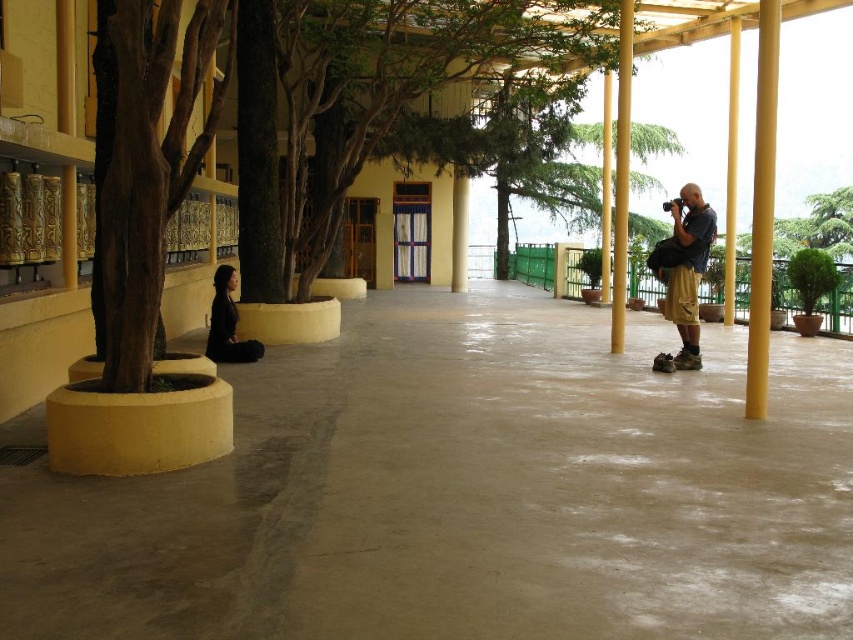
Question: Can you confirm if yellow matte/porous pillar at right is thinner than yellow polished wood pillar at right?

Choices:
 (A) no
 (B) yes

Answer: (B)

Question: Is matte khaki shorts at right to the right of yellow polished wood pillar at right from the viewer's perspective?

Choices:
 (A) yes
 (B) no

Answer: (B)

Question: Among these points, which one is nearest to the camera?

Choices:
 (A) (241, 358)
 (B) (618, 216)
 (C) (126, 268)
 (D) (686, 307)

Answer: (C)

Question: Which of these objects is positioned closest to the brown rough bark tree at left?

Choices:
 (A) yellow polished wood pillar at center
 (B) yellow polished wood pillar at right
 (C) matte khaki shorts at right
 (D) yellow matte/porous pillar at right

Answer: (D)

Question: Where is yellow matte/porous pillar at right located in relation to yellow polished wood pillar at center in the image?

Choices:
 (A) below
 (B) above

Answer: (A)

Question: Which point is farther from the camera taking this photo?

Choices:
 (A) (225, 268)
 (B) (686, 312)
 (C) (730, 76)

Answer: (C)